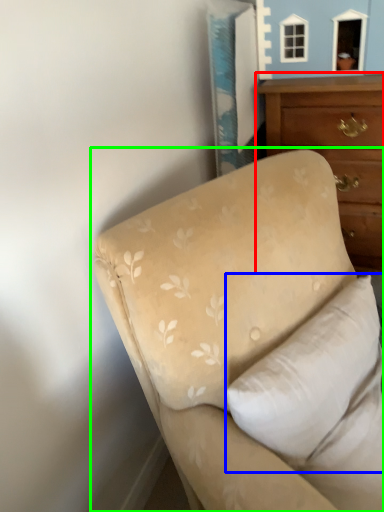
Question: Which is nearer to the chest of drawers (highlighted by a red box)? pillow (highlighted by a blue box) or studio couch (highlighted by a green box).

Choices:
 (A) pillow
 (B) studio couch

Answer: (B)